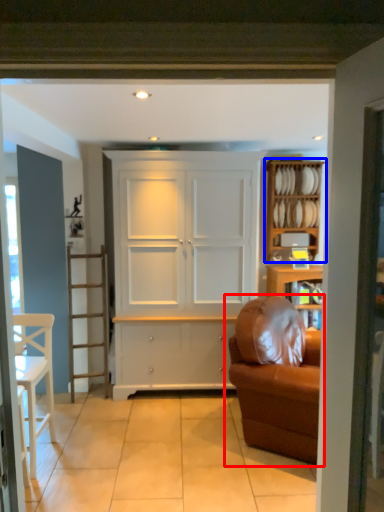
Question: Among these objects, which one is farthest to the camera, studio couch (highlighted by a red box) or shelf (highlighted by a blue box)?

Choices:
 (A) studio couch
 (B) shelf

Answer: (B)